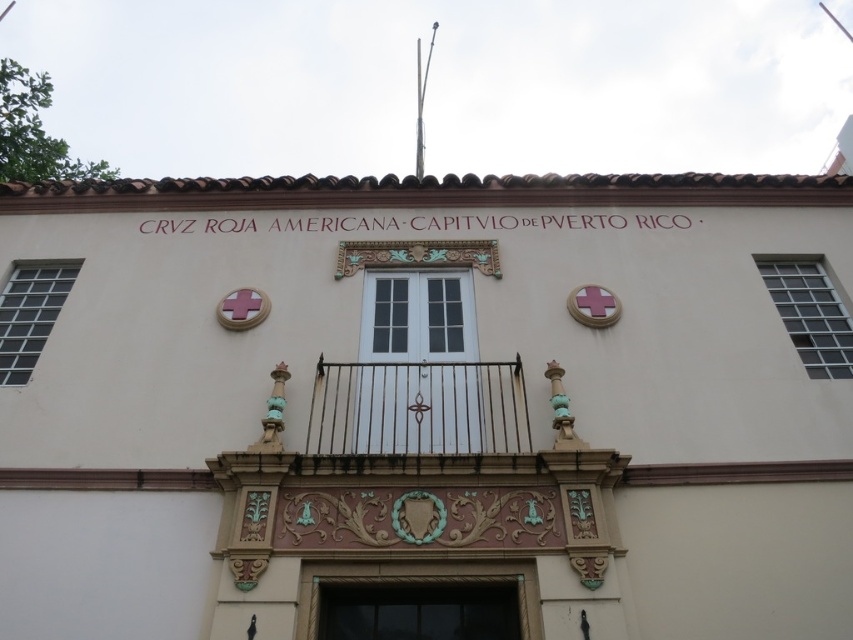
You are standing in front of the Cruz Roja Americana building and notice two points marked on the facade. The first point is at coordinates point (436, 444) and the second is at point (538, 621). Which of these points is closer to you?

Point (538, 621) is closer to you because it is less further away than point (436, 444).